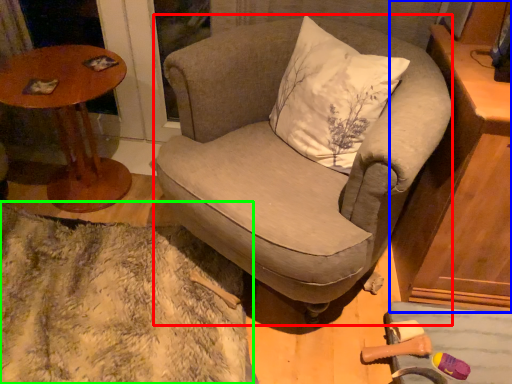
Question: Considering the real-world distances, which object is farthest from chair (highlighted by a red box)? cabinetry (highlighted by a blue box) or blanket (highlighted by a green box)?

Choices:
 (A) cabinetry
 (B) blanket

Answer: (B)